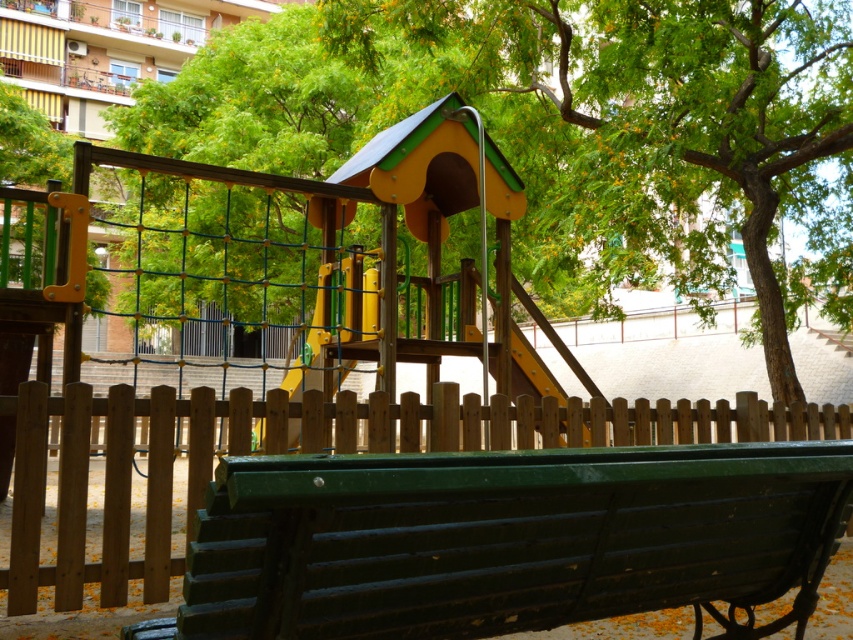
Question: Is green painted wood bench at lower center below green leafy tree at center?

Choices:
 (A) no
 (B) yes

Answer: (B)

Question: Which point is farther to the camera?

Choices:
 (A) green painted wood bench at lower center
 (B) green leafy tree at center

Answer: (B)

Question: Does green painted wood bench at lower center appear on the left side of green leafy tree at center?

Choices:
 (A) no
 (B) yes

Answer: (B)

Question: Considering the relative positions of green painted wood bench at lower center and green leafy tree at center in the image provided, where is green painted wood bench at lower center located with respect to green leafy tree at center?

Choices:
 (A) left
 (B) right

Answer: (A)